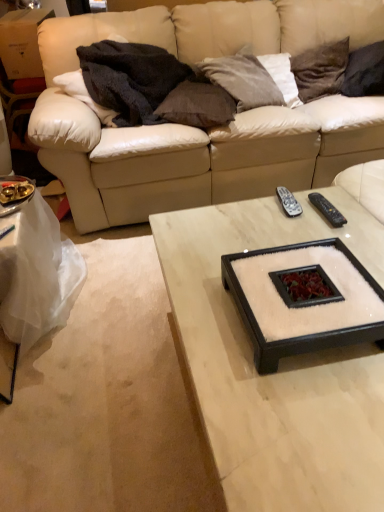
Locate an element on the screen. Image resolution: width=384 pixels, height=512 pixels. free area behind white felt square tray at center is located at coordinates (262, 234).